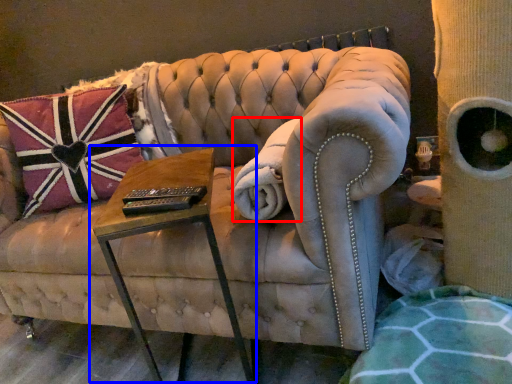
Question: Among these objects, which one is farthest to the camera, blanket (highlighted by a red box) or table (highlighted by a blue box)?

Choices:
 (A) blanket
 (B) table

Answer: (A)